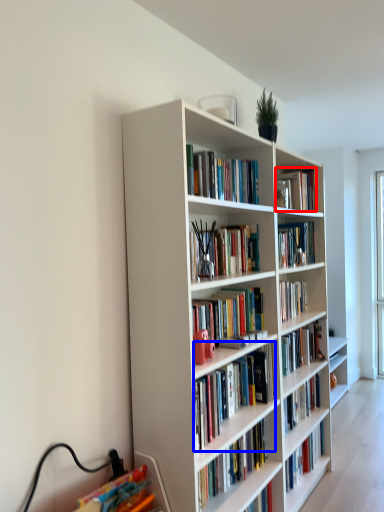
Question: Among these objects, which one is farthest to the camera, book (highlighted by a red box) or book (highlighted by a blue box)?

Choices:
 (A) book
 (B) book

Answer: (A)